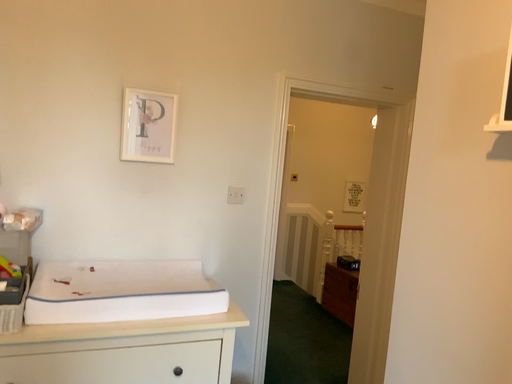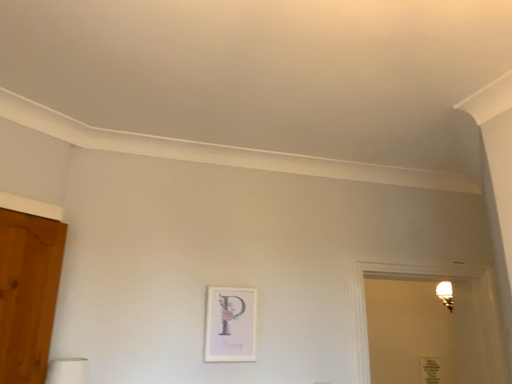
Question: How did the camera likely rotate when shooting the video?

Choices:
 (A) rotated upward
 (B) rotated downward

Answer: (A)